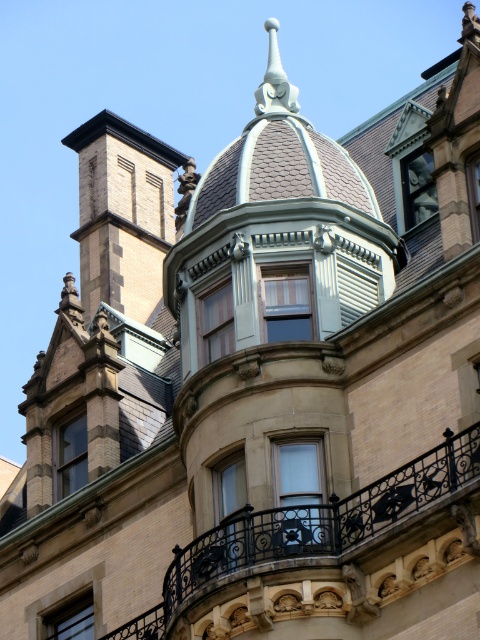
You are an architect planning to install a new decorative element. You have two options based on the existing windows in the scene. Which window, the matte brown window at lower left or the matte stone window at upper right, has a greater width?

The matte brown window at lower left might be wider than the matte stone window at upper right according to the description provided.

You are an architect examining the building facade. You notice the clear glass window at center and the matte brown window at lower left. Which window is positioned to the right side of the other?

The clear glass window at center is positioned to the right of the matte brown window at lower left.

You are standing in front of the grand building and notice a specific point marked at coordinates (321, 518). What architectural feature is located at this point?

The point at (321, 518) corresponds to the polished wrought iron balcony at center.